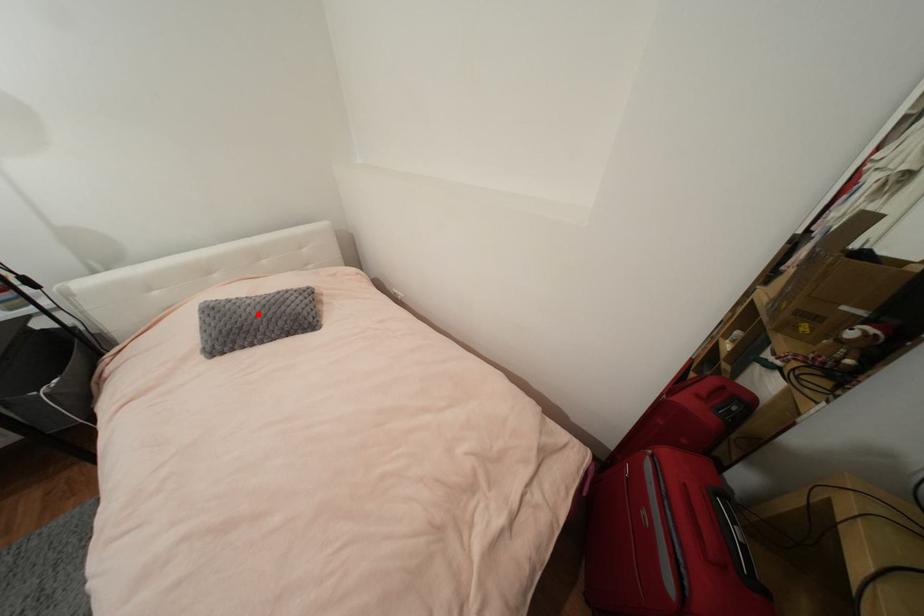
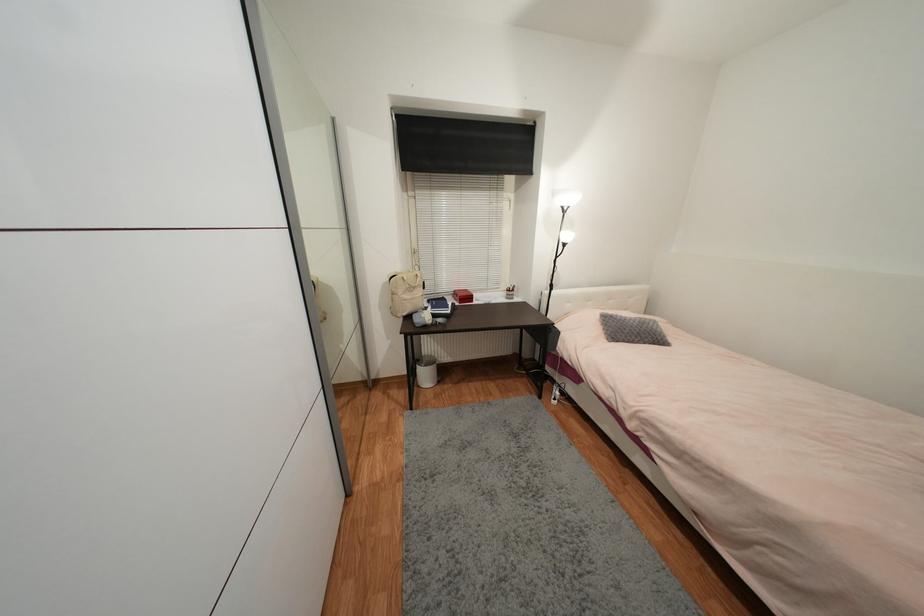
In the second image, find the point that corresponds to the highlighted location in the first image.

(639, 326)